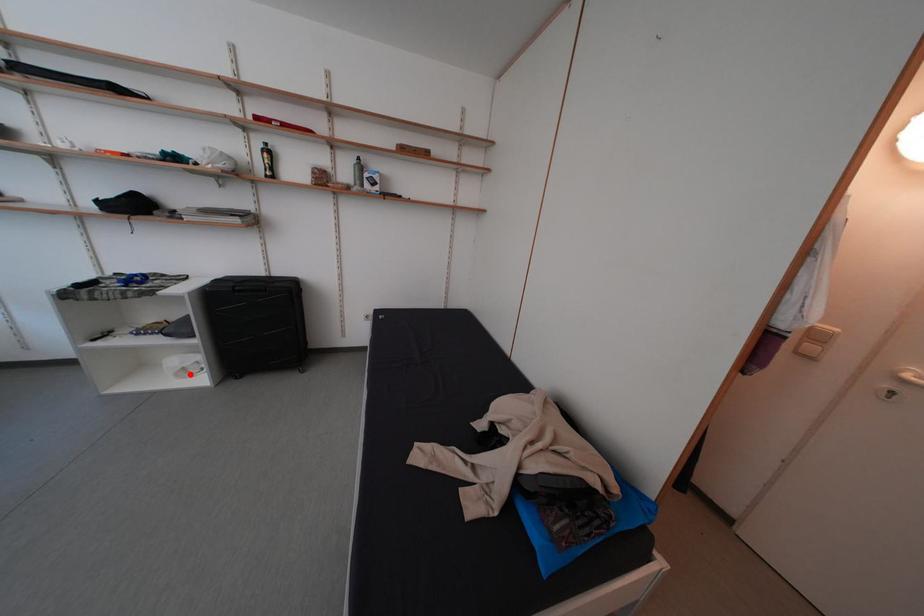
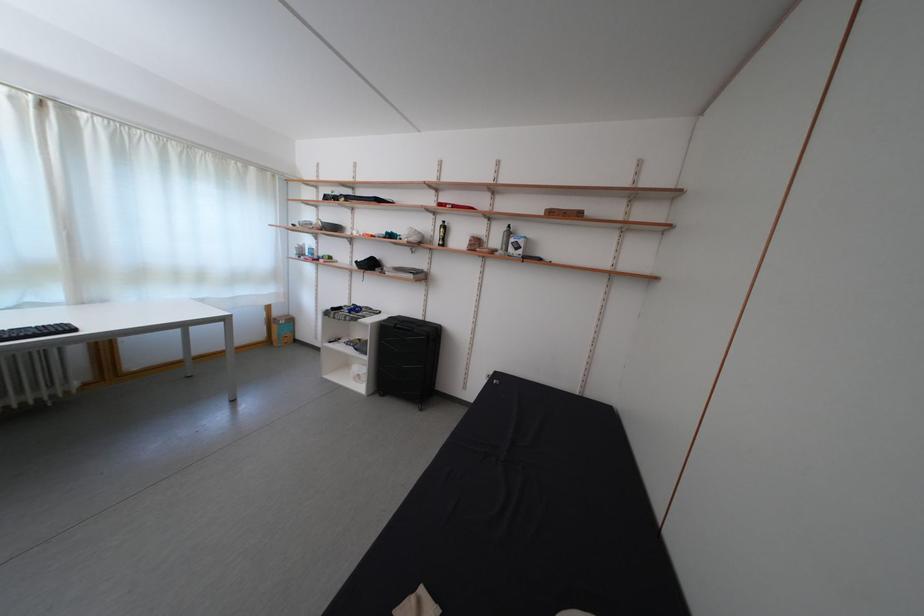
Question: I am providing you with two images of the same scene from different viewpoints. Given a red point in image1, look at the same physical point in image2. Is it:

Choices:
 (A) Closer to the viewpoint
 (B) Farther from the viewpoint

Answer: (B)